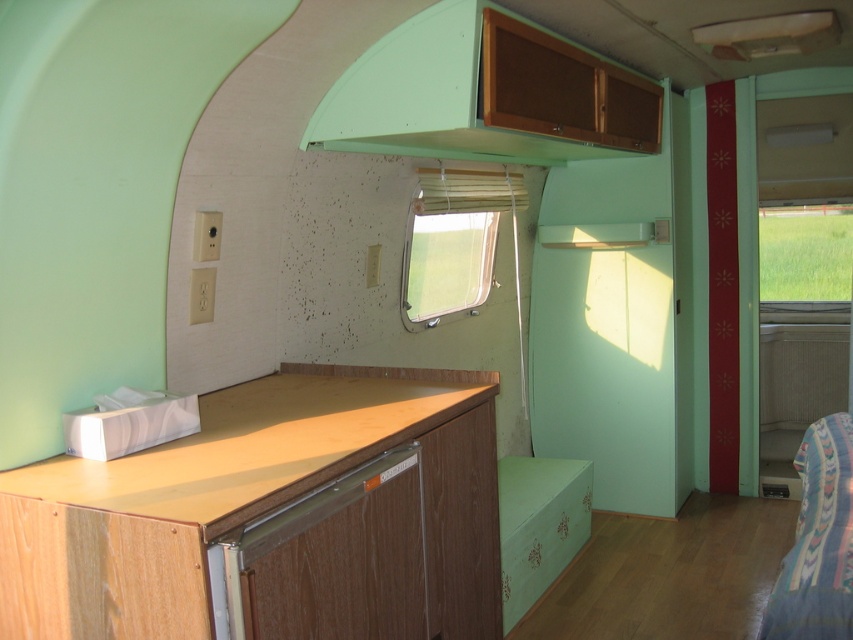
Question: Which is farther from the matte green cabinet at upper center?

Choices:
 (A) patterned fabric bed at lower right
 (B) wooden at lower left
 (C) green glass window at right

Answer: (C)

Question: Is patterned fabric bed at lower right wider than clear plastic window at center?

Choices:
 (A) yes
 (B) no

Answer: (A)

Question: Can you confirm if matte green cabinet at upper center is wider than clear plastic window at center?

Choices:
 (A) no
 (B) yes

Answer: (B)

Question: Which point is farther from the camera taking this photo?

Choices:
 (A) (462, 257)
 (B) (819, 248)

Answer: (B)

Question: Among these objects, which one is farthest from the camera?

Choices:
 (A) wooden at lower left
 (B) clear plastic window at center

Answer: (B)

Question: In this image, where is wooden at lower left located relative to matte green cabinet at upper center?

Choices:
 (A) left
 (B) right

Answer: (A)